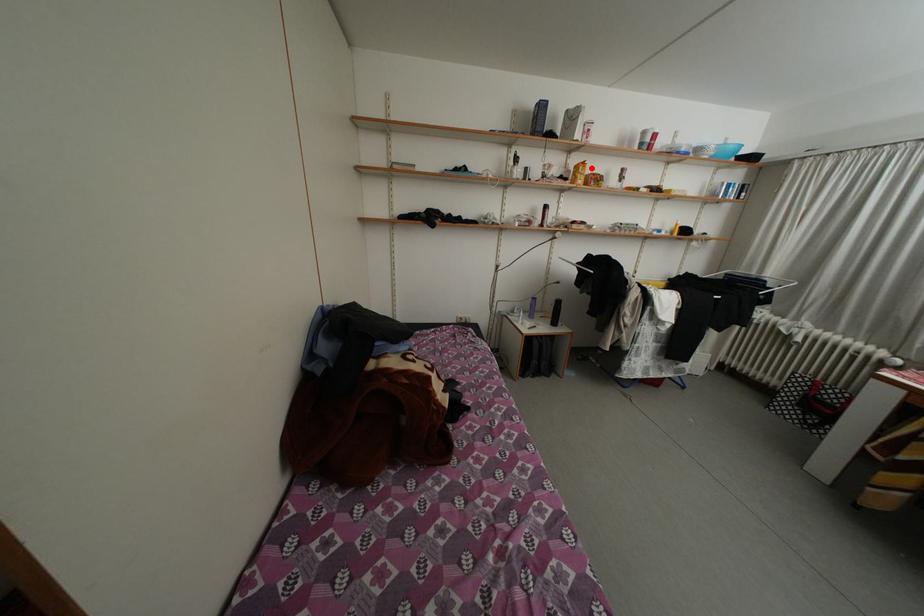
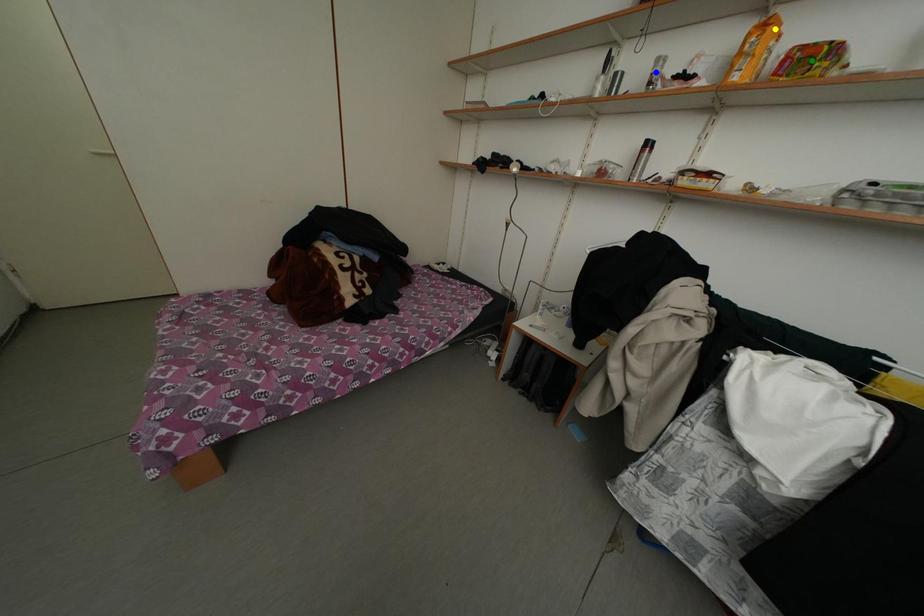
Question: I am providing you with two images of the same scene from different viewpoints. A red point is marked on the first image. You are given multiple points on the second image. Which point in image 2 represents the same 3d spot as the red point in image 1?

Choices:
 (A) green point
 (B) yellow point
 (C) blue point

Answer: (B)